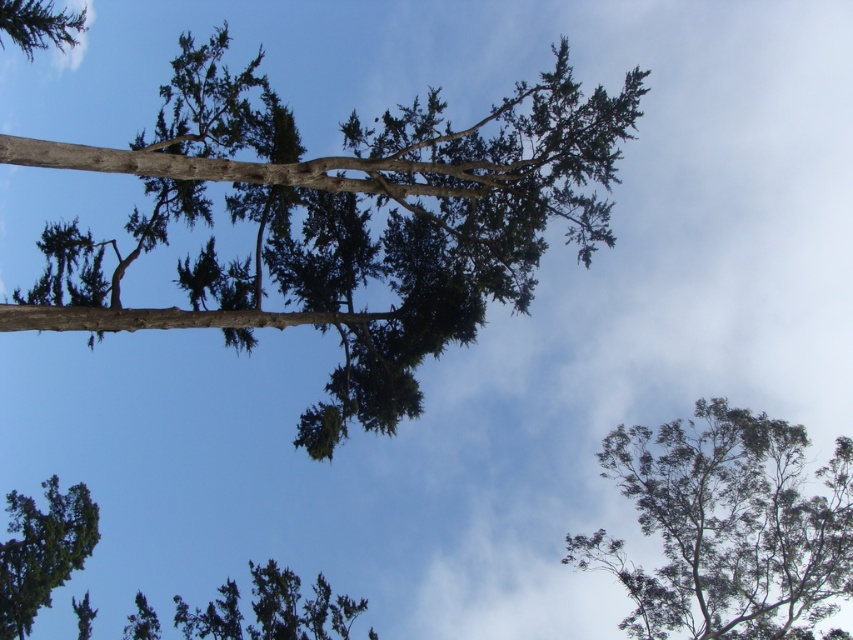
You are standing on the ground looking up at the trees. Which tree is closer to the top of the frame, the green leafy tree at upper right or the green textured tree at lower center?

The green leafy tree at upper right is taller than the green textured tree at lower center, so it is closer to the top of the frame.